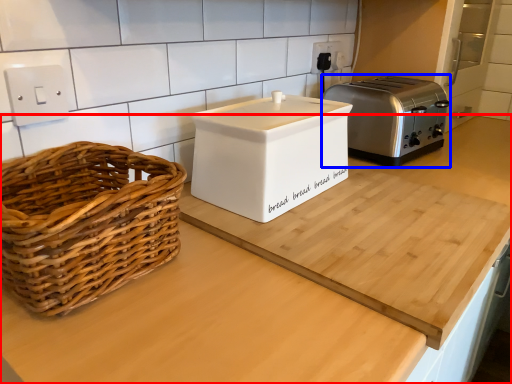
Question: Which of the following is the farthest to the observer, countertop (highlighted by a red box) or toaster (highlighted by a blue box)?

Choices:
 (A) countertop
 (B) toaster

Answer: (B)